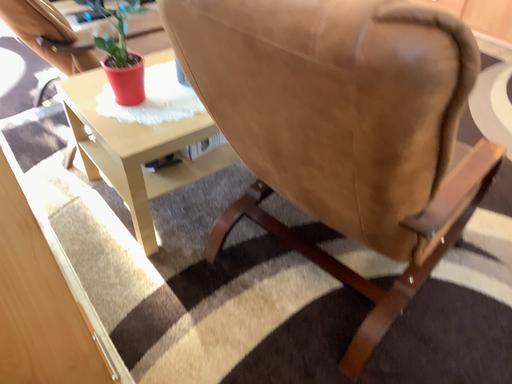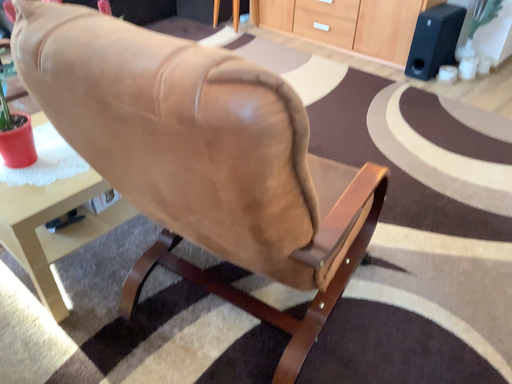
Question: Which way did the camera rotate in the video?

Choices:
 (A) rotated left
 (B) rotated right

Answer: (B)